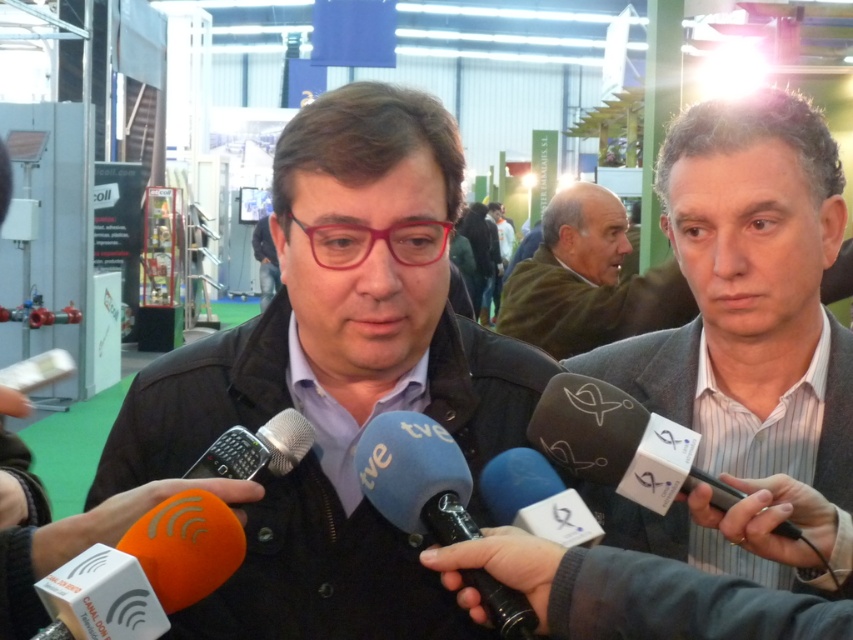
You are a photographer at the event and want to capture a closeup of the blue fabric microphone at center without the gray wool sweater at center blocking it. How should you adjust your camera angle?

The gray wool sweater at center is located above the blue fabric microphone at center. To avoid the sweater blocking the microphone, you can lower your camera angle to shoot from below the sweater, capturing the microphone without obstruction.

You are attending a press conference and notice two items in the scene. One is the gray striped shirt at right and the other is the black plastic microphone at center. Which of these two items is positioned higher in the image?

The gray striped shirt at right is positioned above the black plastic microphone at center, so the gray striped shirt at right is higher.

You are attending a press conference and notice two items at the center of the scene. Which one is positioned to the right of the other? The gray wool sweater at center or the black plastic microphone at center?

The gray wool sweater at center is positioned to the right of the black plastic microphone at center.